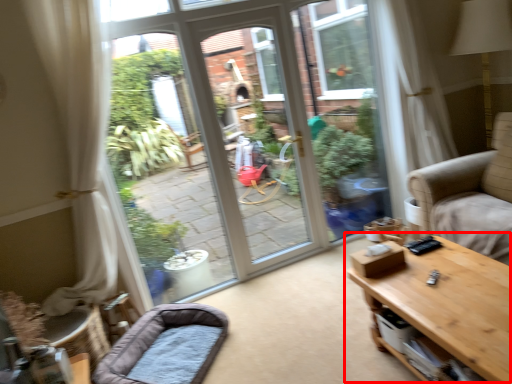
Question: From the image's perspective, considering the relative positions of table (annotated by the red box) and dog bed in the image provided, where is table (annotated by the red box) located with respect to the staircase?

Choices:
 (A) above
 (B) below

Answer: (A)